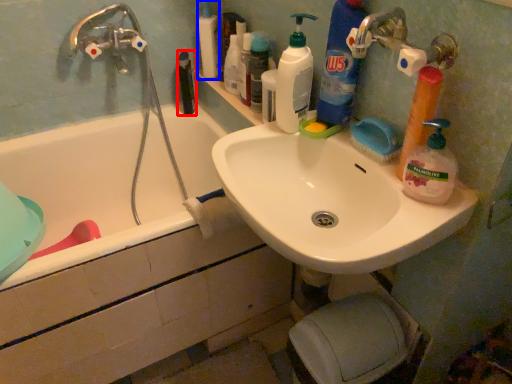
Question: Which object is further to the camera taking this photo, mouthwash (highlighted by a red box) or toiletry (highlighted by a blue box)?

Choices:
 (A) mouthwash
 (B) toiletry

Answer: (A)